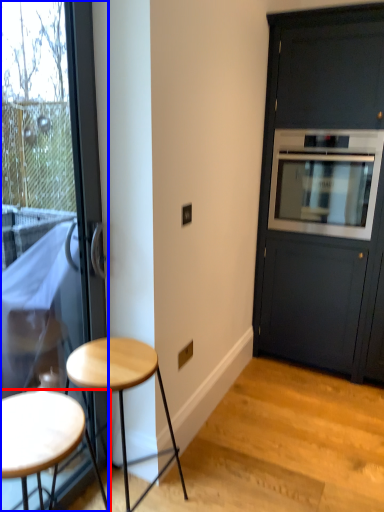
Question: Which object is closer to the camera taking this photo, stool (highlighted by a red box) or door (highlighted by a blue box)?

Choices:
 (A) stool
 (B) door

Answer: (A)